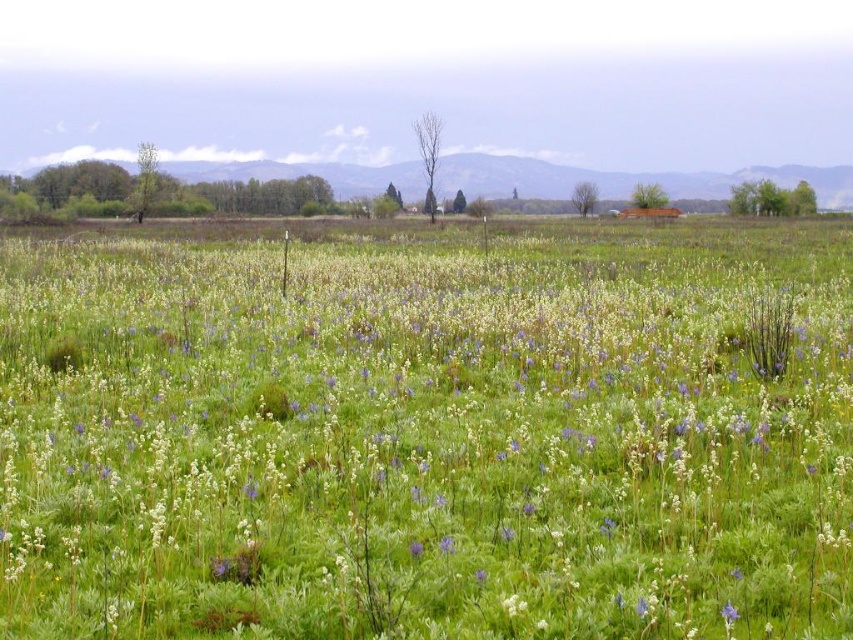
Question: Among these objects, which one is farthest from the camera?

Choices:
 (A) white fluffy plant at center
 (B) purple matte flower at lower right

Answer: (B)

Question: Is white fluffy plant at center further to the viewer compared to purple matte flower at lower right?

Choices:
 (A) no
 (B) yes

Answer: (A)

Question: Considering the relative positions of white fluffy plant at center and purple matte flower at lower right in the image provided, where is white fluffy plant at center located with respect to purple matte flower at lower right?

Choices:
 (A) above
 (B) below

Answer: (A)

Question: From the image, what is the correct spatial relationship of white fluffy plant at center in relation to purple matte flower at lower right?

Choices:
 (A) left
 (B) right

Answer: (A)